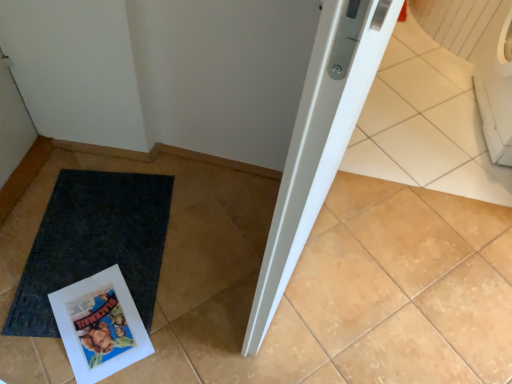
Question: From their relative heights in the image, would you say black rubber mat at lower left is taller or shorter than white glossy comic book at lower left?

Choices:
 (A) short
 (B) tall

Answer: (A)

Question: From the image's perspective, is black rubber mat at lower left positioned above or below white glossy comic book at lower left?

Choices:
 (A) below
 (B) above

Answer: (B)

Question: In the image, is black rubber mat at lower left positioned in front of or behind white glossy comic book at lower left?

Choices:
 (A) behind
 (B) front

Answer: (A)

Question: Is point (96, 311) closer or farther from the camera than point (152, 200)?

Choices:
 (A) closer
 (B) farther

Answer: (A)

Question: Is white glossy comic book at lower left taller or shorter than black rubber mat at lower left?

Choices:
 (A) short
 (B) tall

Answer: (B)

Question: From a real-world perspective, is white glossy comic book at lower left above or below black rubber mat at lower left?

Choices:
 (A) below
 (B) above

Answer: (B)

Question: From the image's perspective, is white glossy comic book at lower left positioned above or below black rubber mat at lower left?

Choices:
 (A) below
 (B) above

Answer: (A)